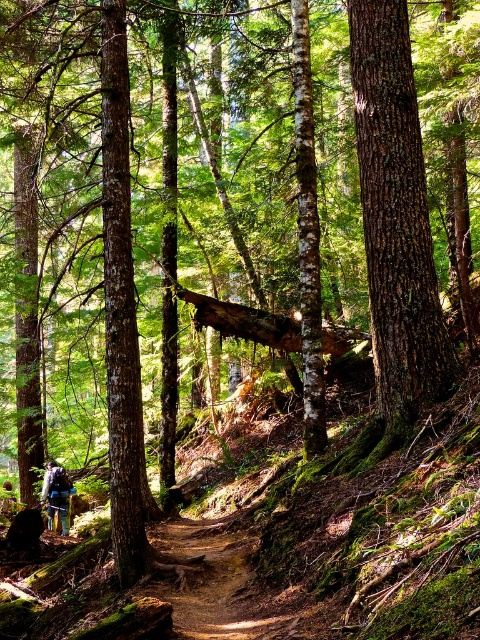
Question: Is brown rough bark tree at center smaller than blue fabric backpack at lower left?

Choices:
 (A) no
 (B) yes

Answer: (A)

Question: Considering the relative positions of brown rough bark tree at center and blue fabric backpack at lower left in the image provided, where is brown rough bark tree at center located with respect to blue fabric backpack at lower left?

Choices:
 (A) above
 (B) below

Answer: (A)

Question: Based on their relative distances, which object is farther from the blue fabric backpack at lower left?

Choices:
 (A) brown rough bark tree at center
 (B) brown dirt trail at center

Answer: (A)

Question: Which point is farther from the camera taking this photo?

Choices:
 (A) (443, 346)
 (B) (223, 561)
 (C) (48, 492)

Answer: (C)

Question: Which point appears closest to the camera in this image?

Choices:
 (A) (54, 467)
 (B) (369, 13)
 (C) (240, 538)

Answer: (B)

Question: Is brown dirt trail at center bigger than blue fabric backpack at lower left?

Choices:
 (A) no
 (B) yes

Answer: (A)